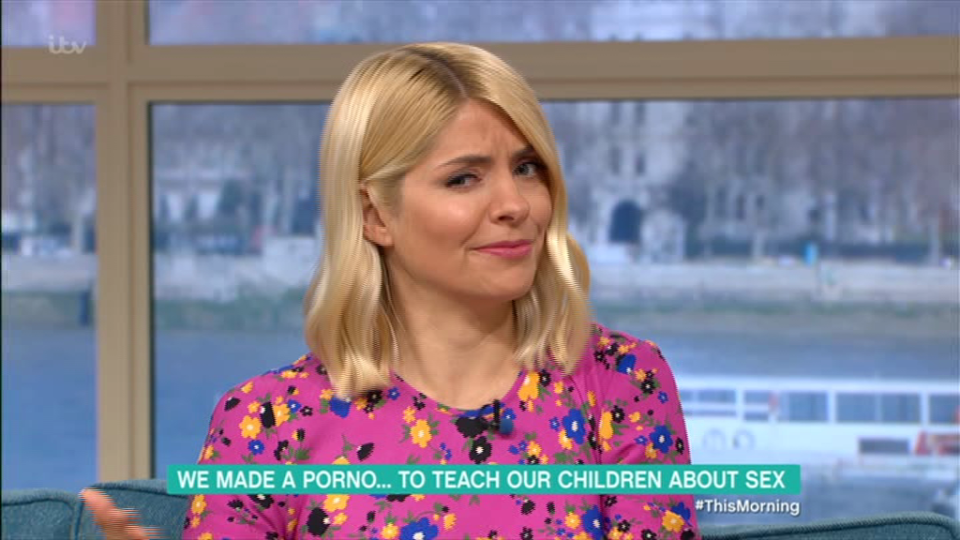
In order to click on couch cushion in this screenshot , I will do `click(916, 529)`, `click(164, 506)`, `click(18, 510)`.